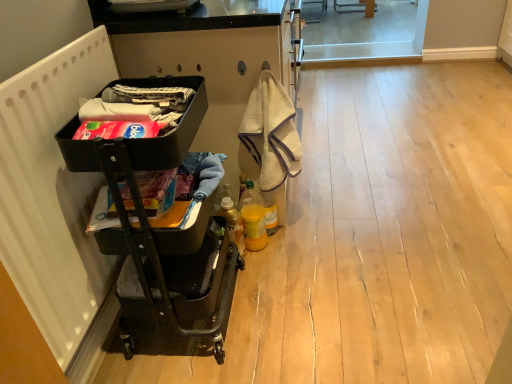
Where is `free spot above black metal cart at left (from a real-world perspective)`? The width and height of the screenshot is (512, 384). free spot above black metal cart at left (from a real-world perspective) is located at coordinates (130, 94).